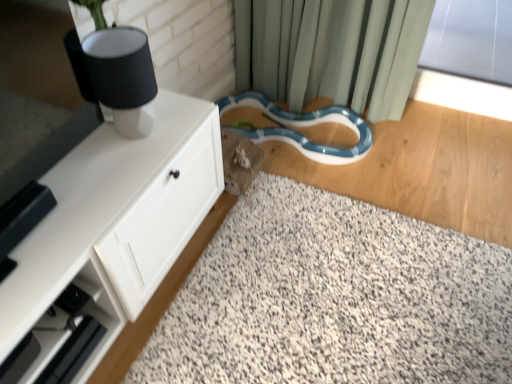
The image size is (512, 384). I want to click on vacant space underneath blue glossy snake at lower center (from a real-world perspective), so click(x=301, y=124).